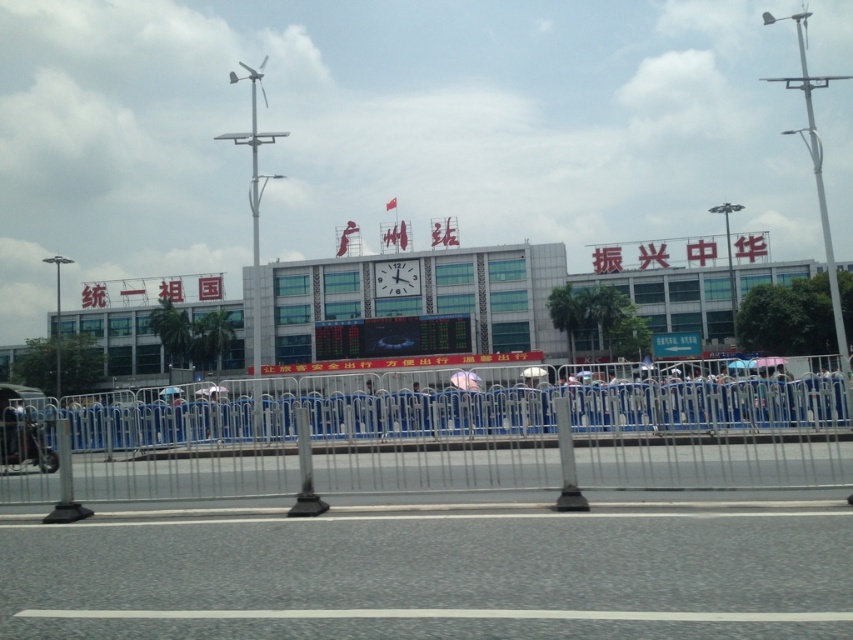
Question: Is metallic blue fence at center smaller than transparent plastic umbrella at center?

Choices:
 (A) yes
 (B) no

Answer: (B)

Question: Is white glossy clock at center to the right of transparent plastic umbrella at center from the viewer's perspective?

Choices:
 (A) no
 (B) yes

Answer: (A)

Question: Which point appears farthest from the camera in this image?

Choices:
 (A) (465, 380)
 (B) (16, 497)
 (C) (807, 147)
 (D) (386, 284)

Answer: (C)

Question: Is the position of metallic blue fence at center more distant than that of pink fabric umbrella at center?

Choices:
 (A) yes
 (B) no

Answer: (B)

Question: Which of the following is the farthest from the observer?

Choices:
 (A) metallic blue fence at center
 (B) transparent plastic umbrella at center
 (C) white glossy clock at center
 (D) white metallic pole at upper right

Answer: (C)

Question: Which point is farther to the camera?

Choices:
 (A) (264, 445)
 (B) (194, 394)

Answer: (B)